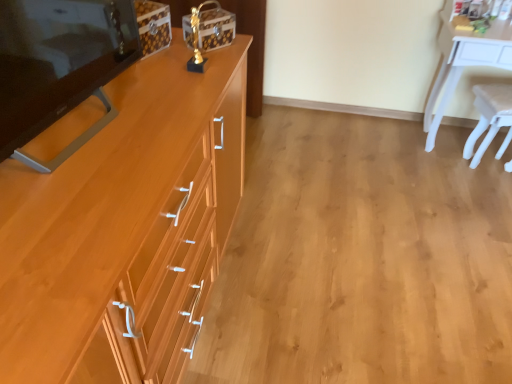
Locate an element on the screen. The image size is (512, 384). vacant space underneath matte wood changing table at left (from a real-world perspective) is located at coordinates (77, 122).